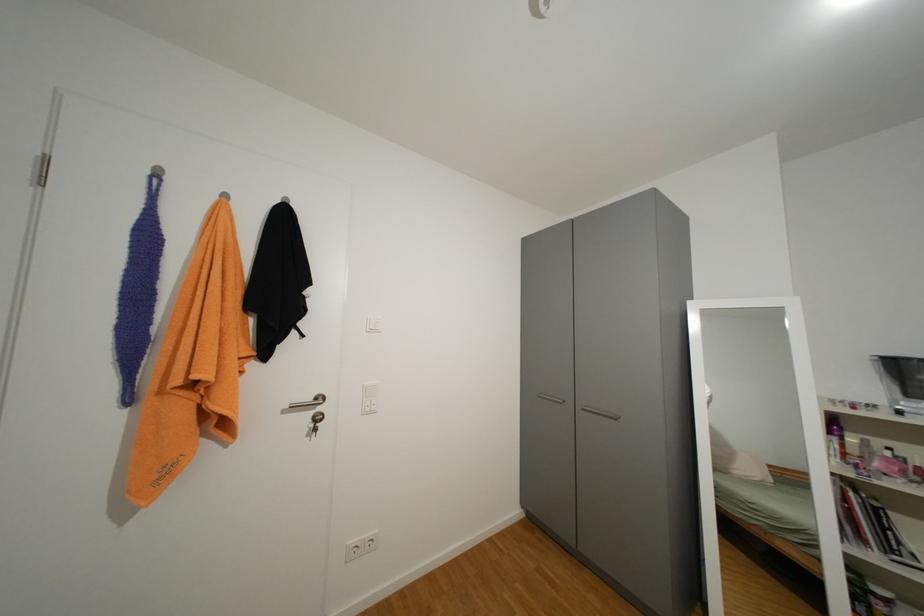
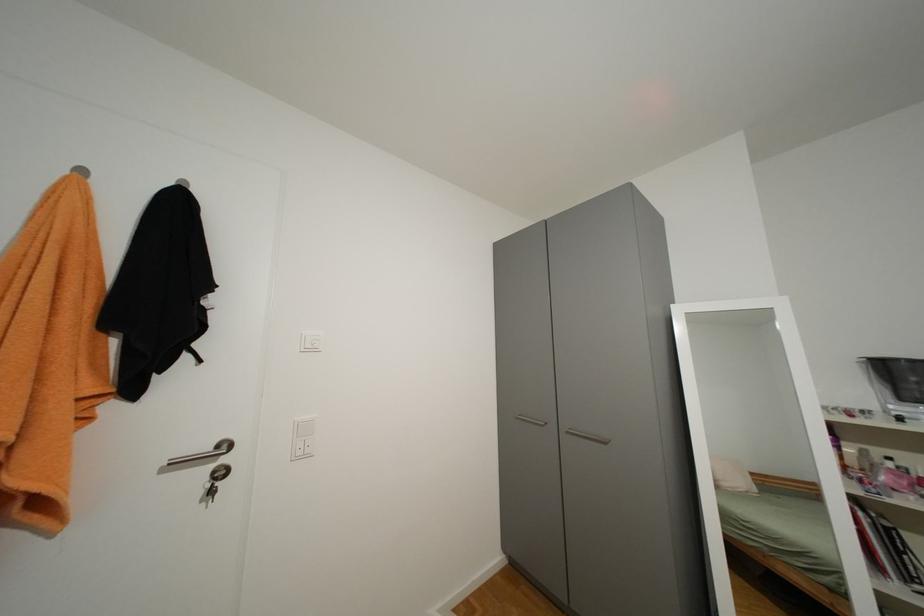
Question: The camera is either moving clockwise (left) or counter-clockwise (right) around the object. The first image is from the beginning of the video and the second image is from the end. Is the camera moving left or right when shooting the video?

Choices:
 (A) Left
 (B) Right

Answer: (A)